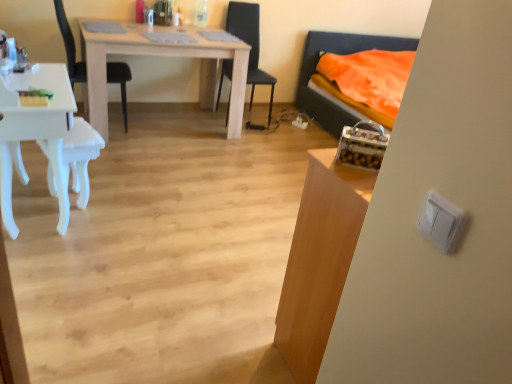
Locate an element on the screen. This screenshot has height=384, width=512. free area in between light wood table at center, the second table in the bottom-to-top sequence, and white glossy switch at right, which ranks as the second table in left-to-right order is located at coordinates (213, 208).